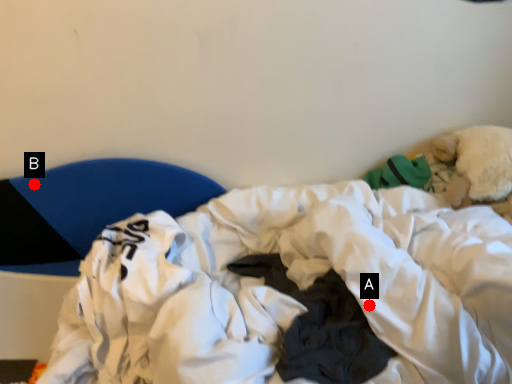
Question: Two points are circled on the image, labeled by A and B beside each circle. Among these points, which one is nearest to the camera?

Choices:
 (A) A is closer
 (B) B is closer

Answer: (A)